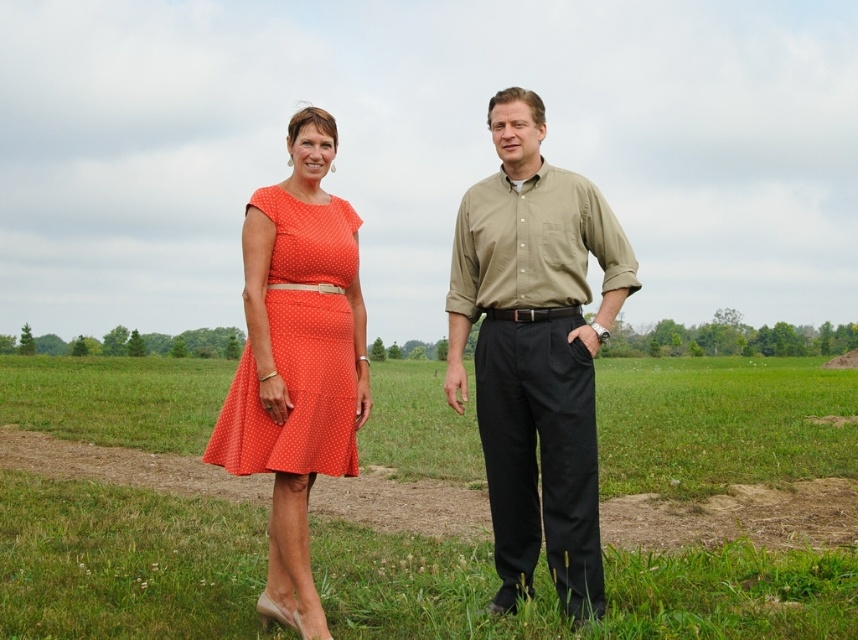
Between point (752, 632) and point (360, 337), which one is positioned in front?

Positioned in front is point (752, 632).

At what (x,y) coordinates should I click in order to perform the action: click on green grass at center. Please return your answer as a coordinate pair (x, y). This screenshot has width=858, height=640. Looking at the image, I should click on (125, 563).

Between point (233, 381) and point (269, 273), which one is positioned in front?

Point (233, 381) is more forward.

Between matte orange dress at center and orange dotted dress at left, which one is positioned lower?

orange dotted dress at left is below.

Does point (497, 244) come behind point (234, 385)?

No.

The image size is (858, 640). Identify the location of matte orange dress at center. (535, 352).

Can you confirm if green grass at center is positioned to the left of orange polka dot dress at left?

In fact, green grass at center is to the right of orange polka dot dress at left.

Is green grass at center behind orange polka dot dress at left?

Yes, green grass at center is behind orange polka dot dress at left.

Describe the element at coordinates (125, 563) in the screenshot. I see `green grass at center` at that location.

At what (x,y) coordinates should I click in order to perform the action: click on green grass at center. Please return your answer as a coordinate pair (x, y). Looking at the image, I should click on (125, 563).